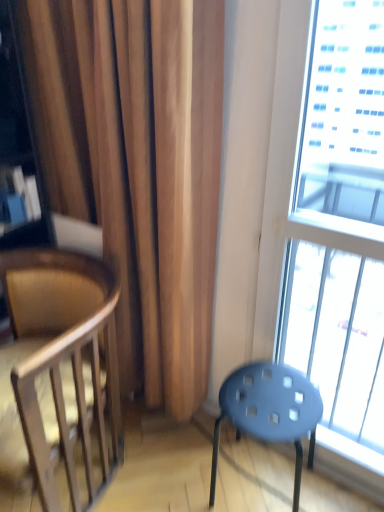
The height and width of the screenshot is (512, 384). I want to click on transparent glass window at right, so click(x=340, y=224).

Identify the location of transparent glass window at right. The height and width of the screenshot is (512, 384). (340, 224).

Between wooden chair at left and matte blue stool at lower right, which one is positioned behind?

matte blue stool at lower right is behind.

From a real-world perspective, is wooden chair at left physically located above or below matte blue stool at lower right?

In terms of real-world spatial position, wooden chair at left is above matte blue stool at lower right.

Where is `chair above the matte blue stool at lower right (from the image's perspective)`? chair above the matte blue stool at lower right (from the image's perspective) is located at coordinates (59, 362).

Based on their sizes in the image, would you say wooden chair at left is bigger or smaller than matte blue stool at lower right?

In the image, wooden chair at left appears to be larger than matte blue stool at lower right.

Which object is positioned more to the right, transparent glass window at right or matte blue stool at lower right?

Positioned to the right is transparent glass window at right.

Considering the sizes of objects transparent glass window at right and matte blue stool at lower right in the image provided, who is shorter, transparent glass window at right or matte blue stool at lower right?

Standing shorter between the two is matte blue stool at lower right.

How far apart are transparent glass window at right and matte blue stool at lower right?

transparent glass window at right and matte blue stool at lower right are 25.72 inches apart.

How many degrees apart are the facing directions of transparent glass window at right and matte blue stool at lower right?

The facing directions of transparent glass window at right and matte blue stool at lower right are 10 degrees apart.

Could wooden chair at left be considered to be inside matte blue stool at lower right?

No, wooden chair at left is not inside matte blue stool at lower right.

Is matte blue stool at lower right wider or thinner than wooden chair at left?

In the image, matte blue stool at lower right appears to be more narrow than wooden chair at left.

Is matte blue stool at lower right facing away from wooden chair at left?

matte blue stool at lower right does not have its back to wooden chair at left.

From the picture: Does matte blue stool at lower right lie in front of wooden chair at left?

No, matte blue stool at lower right is further to the viewer.

Can you confirm if transparent glass window at right is taller than wooden chair at left?

Yes, transparent glass window at right is taller than wooden chair at left.

Locate an element on the screen. Image resolution: width=384 pixels, height=512 pixels. window above the wooden chair at left (from a real-world perspective) is located at coordinates (340, 224).

Which object is more forward, transparent glass window at right or wooden chair at left?

transparent glass window at right is closer to the camera.

Which of these two, transparent glass window at right or wooden chair at left, is bigger?

wooden chair at left is bigger.

Is wooden chair at left shorter than transparent glass window at right?

Indeed, wooden chair at left has a lesser height compared to transparent glass window at right.

Does wooden chair at left appear on the right side of transparent glass window at right?

No.

Looking at the image, does wooden chair at left seem bigger or smaller compared to transparent glass window at right?

In the image, wooden chair at left appears to be larger than transparent glass window at right.

Is point (41, 306) farther from camera compared to point (373, 298)?

No, it is in front of (373, 298).

From the image's perspective, is matte blue stool at lower right under transparent glass window at right?

Correct, matte blue stool at lower right appears lower than transparent glass window at right in the image.

Can you confirm if matte blue stool at lower right is taller than transparent glass window at right?

Incorrect, the height of matte blue stool at lower right is not larger of that of transparent glass window at right.

Can you confirm if matte blue stool at lower right is smaller than transparent glass window at right?

No.

Which is correct: matte blue stool at lower right is inside transparent glass window at right, or outside of it?

matte blue stool at lower right is spatially situated outside transparent glass window at right.

This screenshot has height=512, width=384. In order to click on chair above the matte blue stool at lower right (from the image's perspective) in this screenshot , I will do `click(59, 362)`.

Image resolution: width=384 pixels, height=512 pixels. Find the location of `stool that appears on the left of transparent glass window at right`. stool that appears on the left of transparent glass window at right is located at coordinates (269, 411).

When comparing their distances from matte blue stool at lower right, does wooden chair at left or transparent glass window at right seem closer?

wooden chair at left.

Considering their positions, is transparent glass window at right positioned closer to wooden chair at left than matte blue stool at lower right?

matte blue stool at lower right.

Based on their spatial positions, is transparent glass window at right or wooden chair at left further from matte blue stool at lower right?

transparent glass window at right lies further to matte blue stool at lower right than the other object.

Looking at the image, which one is located further to transparent glass window at right, wooden chair at left or matte blue stool at lower right?

wooden chair at left is further to transparent glass window at right.

From the image, which object appears to be nearer to wooden chair at left, matte blue stool at lower right or transparent glass window at right?

The object closer to wooden chair at left is matte blue stool at lower right.

From the image, which object appears to be farther from transparent glass window at right, matte blue stool at lower right or wooden chair at left?

wooden chair at left is further to transparent glass window at right.

Identify the location of stool between wooden chair at left and transparent glass window at right from left to right. This screenshot has height=512, width=384. (269, 411).